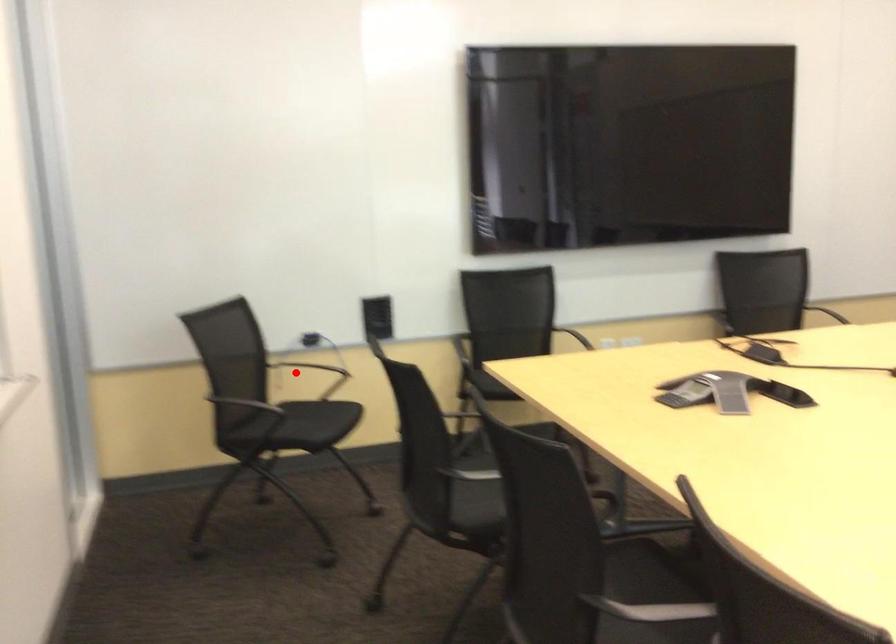
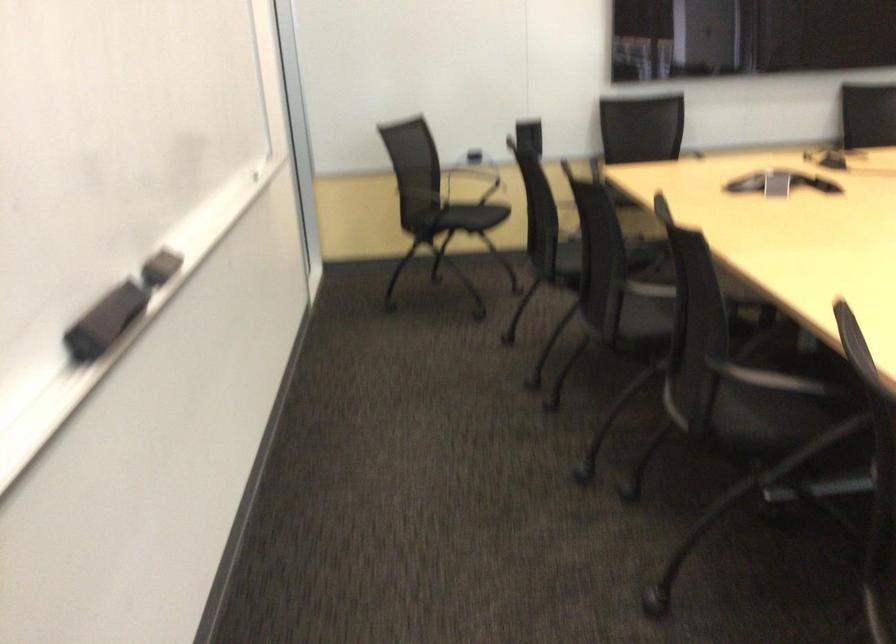
In the second image, find the point that corresponds to the highlighted location in the first image.

(472, 180)